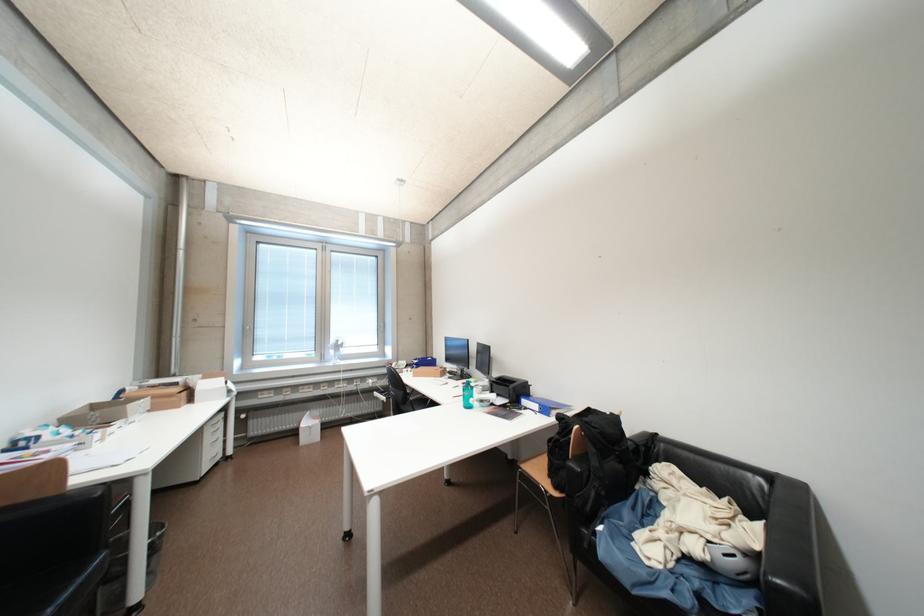
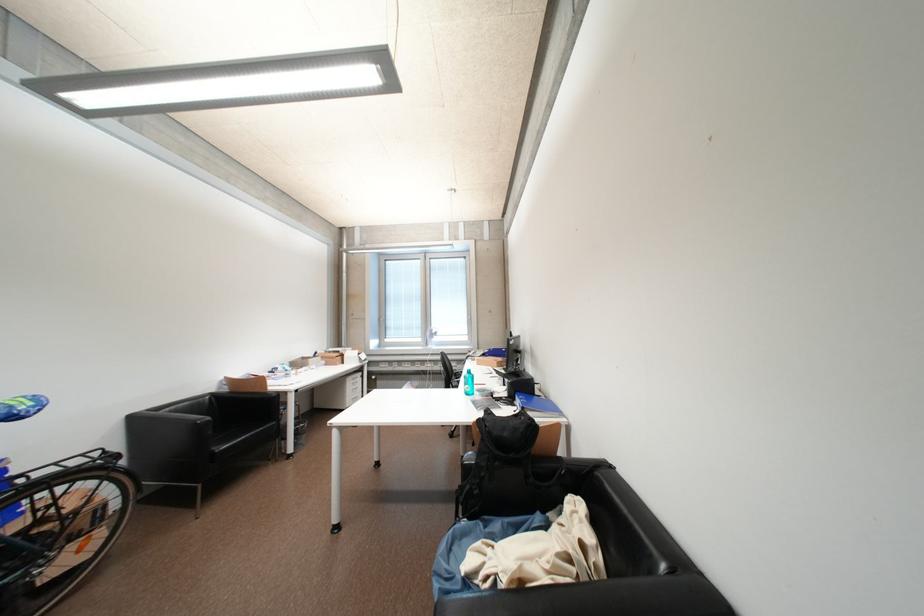
Question: I am providing you with two images of the same scene from different viewpoints. Please identify which objects are invisible in image2.

Choices:
 (A) sofa sitting surface
 (B) black backpack handle
 (C) light blue bottle
 (D) none of these

Answer: (D)